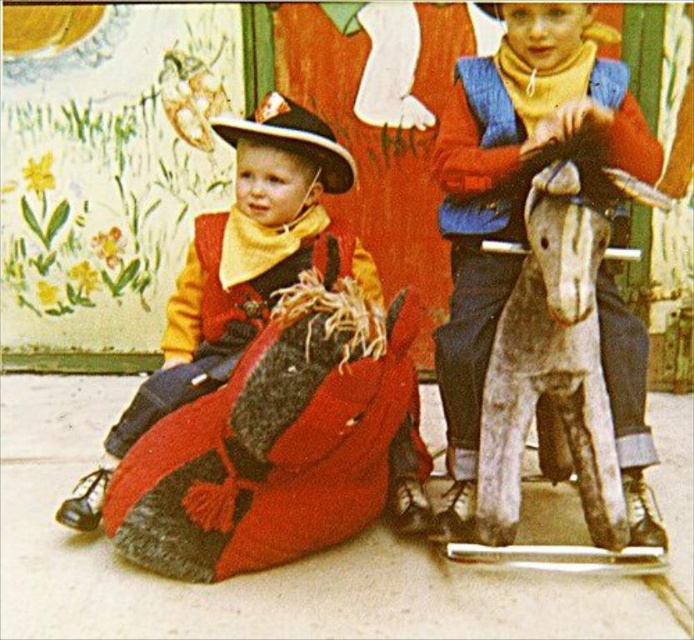
You are standing at the origin point of the image. The wooden rocking horse at center is located at coordinates point 0.284, 0.745. If you want to walk straight towards it, in which direction should you move?

You should move towards the coordinates point (516, 180) to reach the wooden rocking horse at center.

You are a photographer setting up for a photoshoot. You need to place a small tripod between the fuzzy red blanket at lower left and the matte brown cowboy hat at center. According to the scene description, where should you place the tripod to ensure it is between these two objects?

The fuzzy red blanket at lower left is positioned on the left side of matte brown cowboy hat at center. Therefore, the tripod should be placed to the right of the fuzzy red blanket at lower left and to the left of the matte brown cowboy hat at center, between them.

You are standing at the point labeled point (627, 340) and want to walk to the point labeled point (162, 348). Which direction should you move?

Since point (627, 340) is in front of point (162, 348), you should move backward to reach point (162, 348).